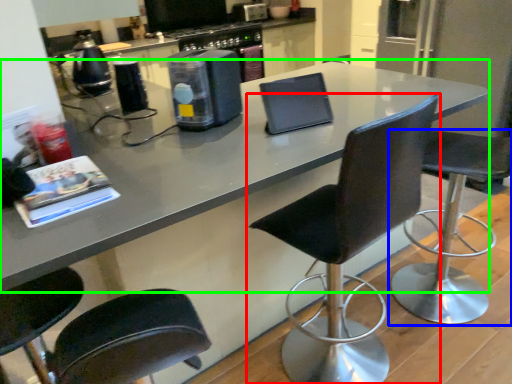
Question: Which object is the farthest from chair (highlighted by a red box)? Choose among these: chair (highlighted by a blue box) or countertop (highlighted by a green box).

Choices:
 (A) chair
 (B) countertop

Answer: (A)